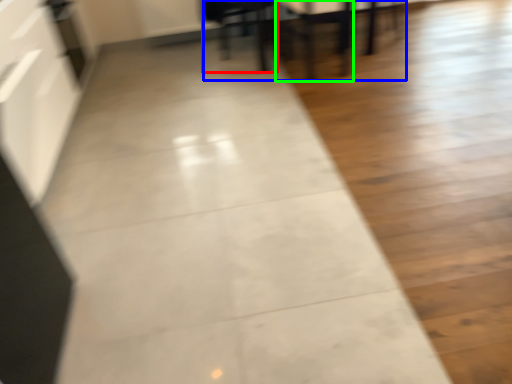
Question: Considering the real-world distances, which object is closest to furniture (highlighted by a red box)? table (highlighted by a blue box) or armchair (highlighted by a green box).

Choices:
 (A) table
 (B) armchair

Answer: (A)